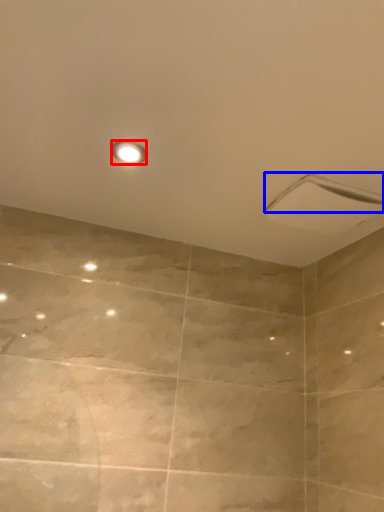
Question: Which object is closer to the camera taking this photo, light fixture (highlighted by a red box) or shower (highlighted by a blue box)?

Choices:
 (A) light fixture
 (B) shower

Answer: (A)